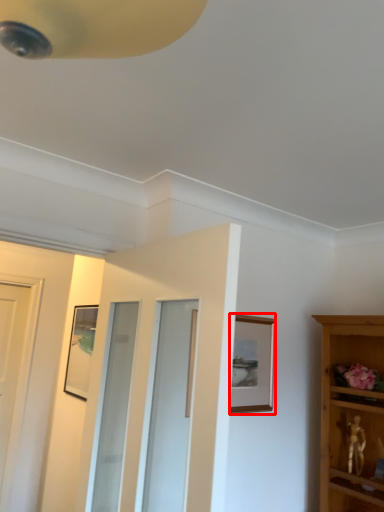
Question: From the image's perspective, where is picture frame (annotated by the red box) located in relation to door in the image?

Choices:
 (A) above
 (B) below

Answer: (B)